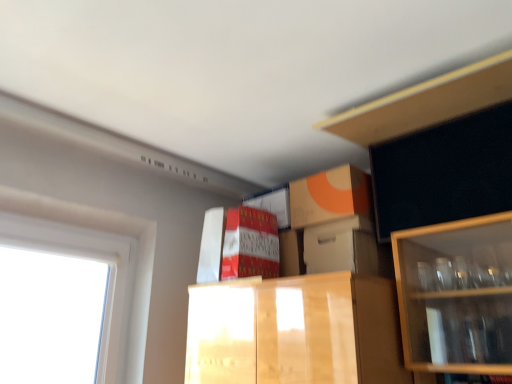
Question: Is white cardboard box at center directly adjacent to wooden cabinet at upper right?

Choices:
 (A) no
 (B) yes

Answer: (A)

Question: Is white cardboard box at center surrounding wooden cabinet at upper right?

Choices:
 (A) yes
 (B) no

Answer: (B)

Question: Considering the relative positions of white cardboard box at center and wooden cabinet at upper right in the image provided, is white cardboard box at center behind wooden cabinet at upper right?

Choices:
 (A) no
 (B) yes

Answer: (B)

Question: Considering the relative sizes of white cardboard box at center and wooden cabinet at upper right in the image provided, is white cardboard box at center bigger than wooden cabinet at upper right?

Choices:
 (A) yes
 (B) no

Answer: (B)

Question: From a real-world perspective, is white cardboard box at center positioned under wooden cabinet at upper right based on gravity?

Choices:
 (A) no
 (B) yes

Answer: (B)

Question: Is white cardboard box at center closer to camera compared to wooden cabinet at upper right?

Choices:
 (A) yes
 (B) no

Answer: (B)

Question: Considering the relative positions of white cardboard box at center and white plastic window at left in the image provided, is white cardboard box at center to the left of white plastic window at left from the viewer's perspective?

Choices:
 (A) no
 (B) yes

Answer: (A)

Question: Is white cardboard box at center bigger than white plastic window at left?

Choices:
 (A) no
 (B) yes

Answer: (A)

Question: Is the position of white cardboard box at center less distant than that of white plastic window at left?

Choices:
 (A) no
 (B) yes

Answer: (A)

Question: Does white cardboard box at center have a lesser width compared to white plastic window at left?

Choices:
 (A) no
 (B) yes

Answer: (A)

Question: Could you tell me if white cardboard box at center is facing white plastic window at left?

Choices:
 (A) no
 (B) yes

Answer: (A)

Question: Does white cardboard box at center have a smaller size compared to white plastic window at left?

Choices:
 (A) no
 (B) yes

Answer: (B)

Question: Considering the relative positions of matte cardboard box at center and wooden cabinet at upper right in the image provided, is matte cardboard box at center to the left of wooden cabinet at upper right from the viewer's perspective?

Choices:
 (A) yes
 (B) no

Answer: (A)